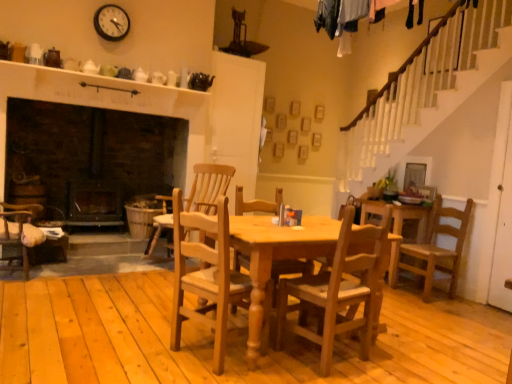
Find the location of a particular element. This screenshot has height=384, width=512. free point below natural wood chair at center, marked as the third chair in a right-to-left arrangement (from a real-world perspective) is located at coordinates (195, 355).